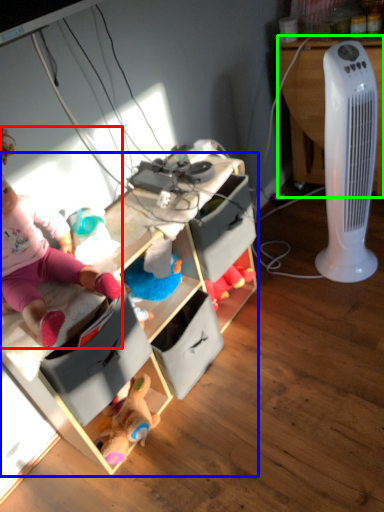
Question: Which object is positioned closest to person (highlighted by a red box)? Select from cabinetry (highlighted by a blue box) and desk (highlighted by a green box).

Choices:
 (A) cabinetry
 (B) desk

Answer: (A)